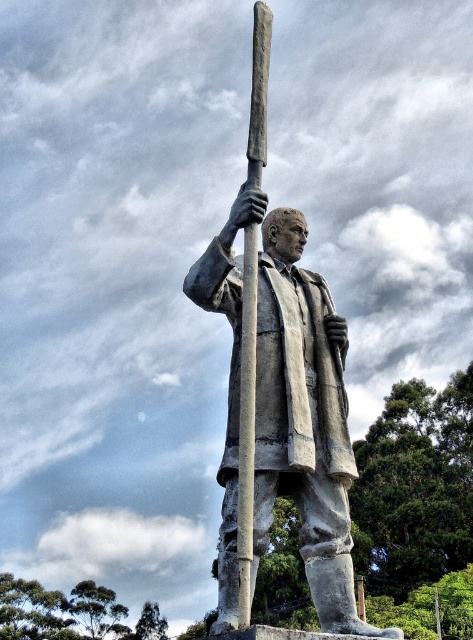
Question: Does bronze statue at center come behind gray stone pole at center?

Choices:
 (A) no
 (B) yes

Answer: (B)

Question: Does bronze statue at center appear over gray stone pole at center?

Choices:
 (A) yes
 (B) no

Answer: (B)

Question: Is bronze statue at center above gray stone pole at center?

Choices:
 (A) yes
 (B) no

Answer: (B)

Question: Which point is closer to the camera taking this photo?

Choices:
 (A) (251, 240)
 (B) (265, 428)

Answer: (B)

Question: Which point is closer to the camera?

Choices:
 (A) (247, 385)
 (B) (332, 493)

Answer: (A)